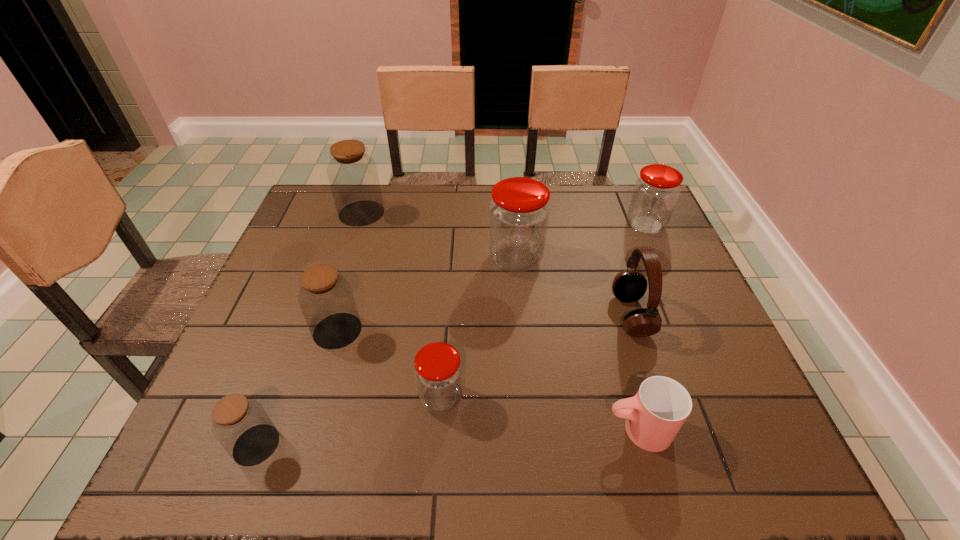
Locate an element on the screen. The height and width of the screenshot is (540, 960). the nearest jar is located at coordinates (240, 424).

Image resolution: width=960 pixels, height=540 pixels. In order to click on the nearest brown jar in this screenshot , I will do `click(240, 424)`.

Image resolution: width=960 pixels, height=540 pixels. I want to click on cup, so click(x=654, y=416).

You are a GUI agent. You are given a task and a screenshot of the screen. Output one action in this format:
    pyautogui.click(x=<x>, y=<y>)
    Task: Click on the free region located on the right of the farthest brown jar
    
    Given the screenshot: What is the action you would take?
    pyautogui.click(x=403, y=213)

You are a GUI agent. You are given a task and a screenshot of the screen. Output one action in this format:
    pyautogui.click(x=<x>, y=<y>)
    Task: Click on the free space located 0.140m on the right of the second red jar from right to left
    This screenshot has height=540, width=960.
    Given the screenshot: What is the action you would take?
    pyautogui.click(x=593, y=259)

I want to click on free space located 0.210m on the ear pads of the headset, so click(x=528, y=315).

In order to click on free space located 0.130m on the ear pads of the headset in this screenshot , I will do `click(561, 315)`.

Where is `free space located on the ear pads of the headset`? Image resolution: width=960 pixels, height=540 pixels. free space located on the ear pads of the headset is located at coordinates (x=593, y=315).

At what (x,y) coordinates should I click in order to perform the action: click on free space located 0.380m on the front of the second biggest red jar. Please return your answer as a coordinate pair (x, y). This screenshot has height=540, width=960. Looking at the image, I should click on (697, 341).

Where is `free spot located 0.220m on the right of the fourth farthest jar`? The image size is (960, 540). free spot located 0.220m on the right of the fourth farthest jar is located at coordinates (454, 330).